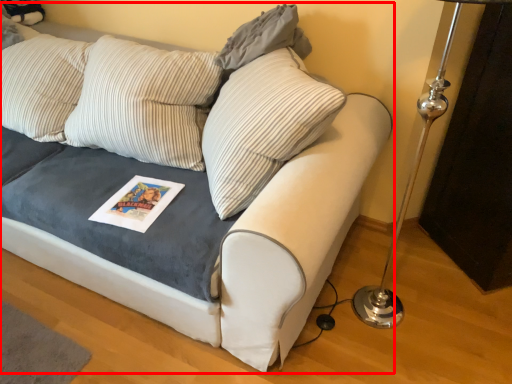
Question: Where is studio couch (annotated by the red box) located in relation to pillow in the image?

Choices:
 (A) right
 (B) left

Answer: (B)